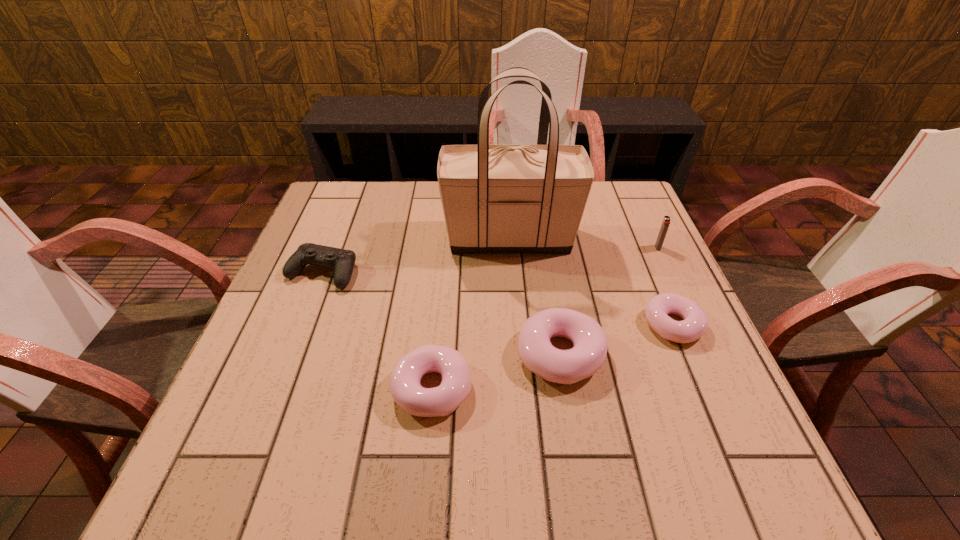
Please point out where to position a new doughnut on the left to maintain spacing. Please provide its 2D coordinates. Your answer should be formatted as a tuple, i.e. [(x, y)], where the tuple contains the x and y coordinates of a point satisfying the conditions above.

[(286, 425)]